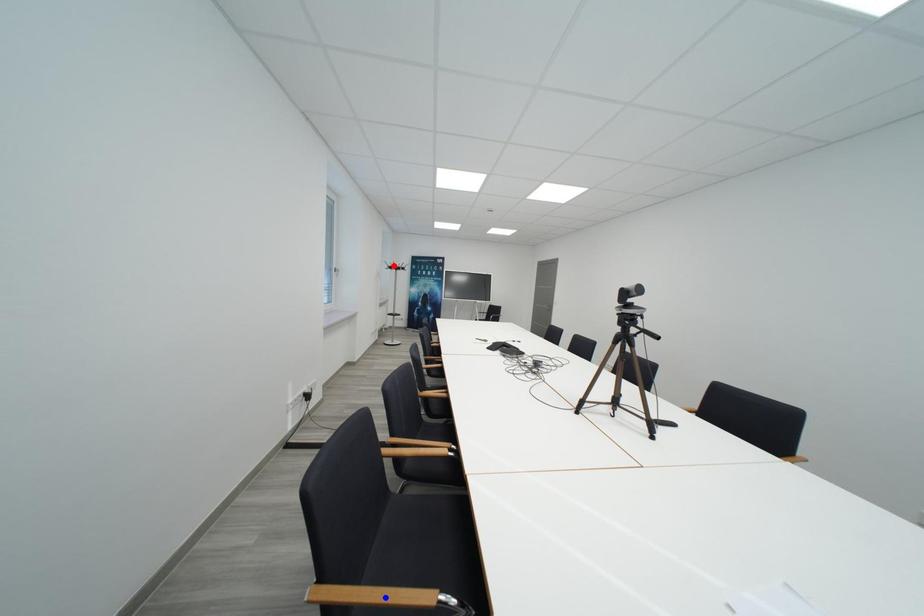
Question: Which of the two points in the image is closer to the camera?

Choices:
 (A) Blue point is closer.
 (B) Red point is closer.

Answer: (A)